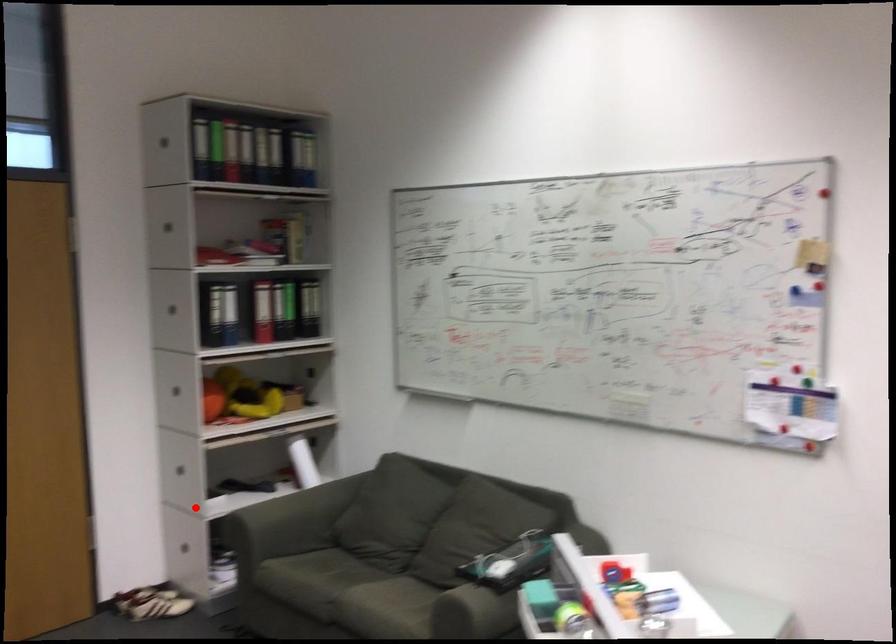
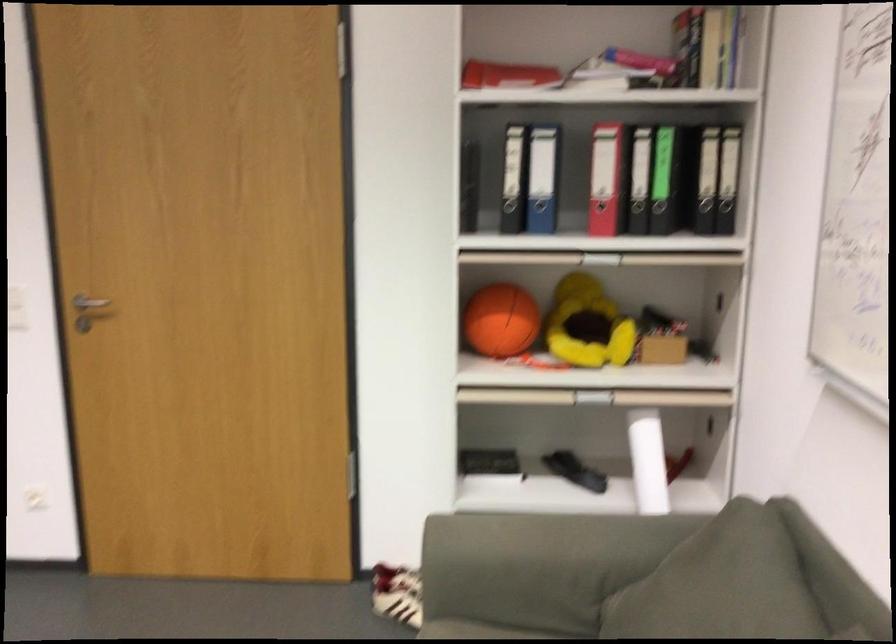
Question: I am providing you with two images of the same scene from different viewpoints. In image1, a red point is highlighted. Considering the same 3D point in image2, which of the following is correct?

Choices:
 (A) It is closer
 (B) It is farther

Answer: (A)